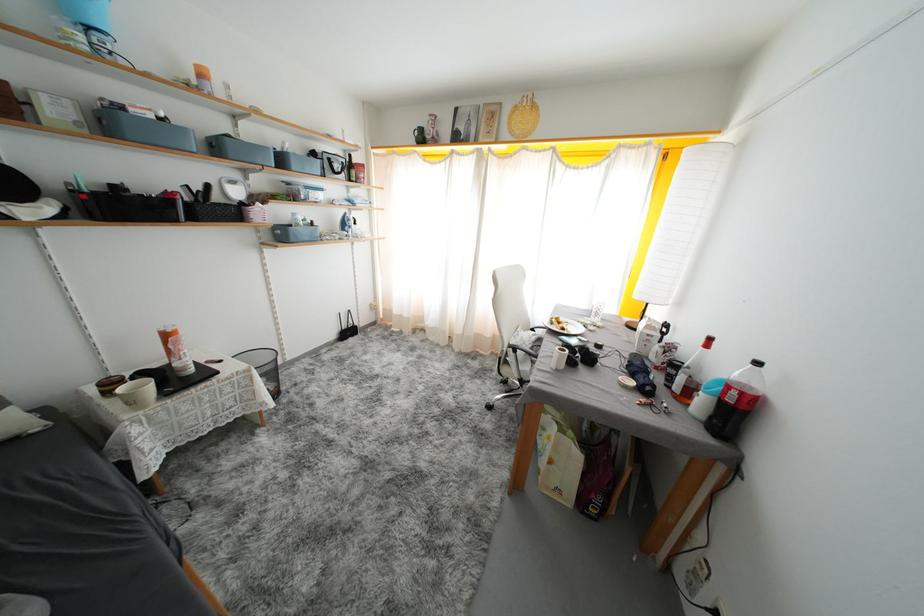
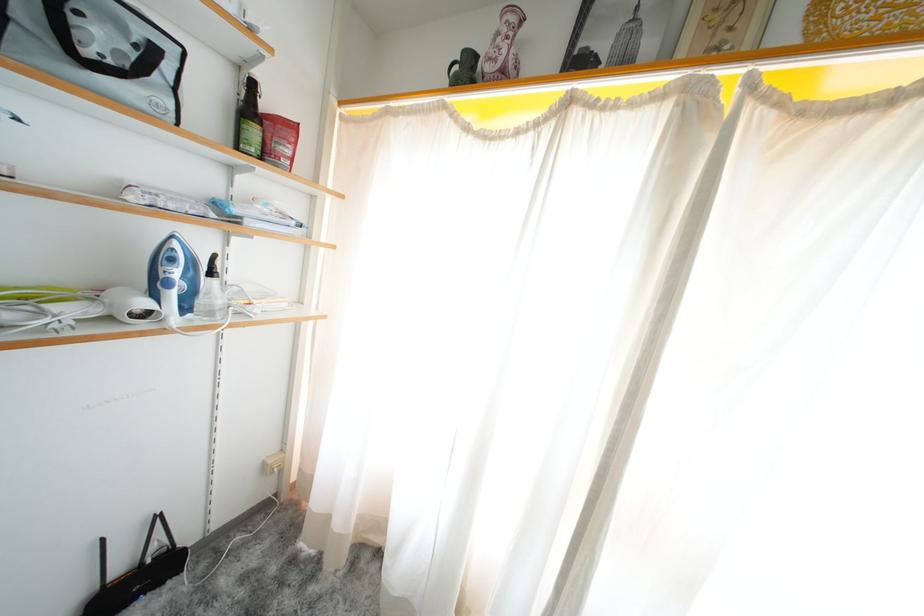
Where in the second image is the point corresponding to point 355,336 from the first image?

(143, 586)